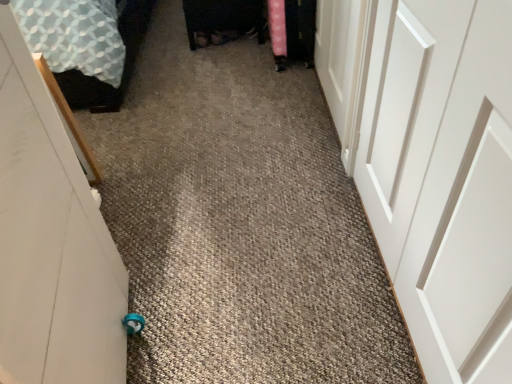
Question: Is point (396, 52) closer or farther from the camera than point (1, 258)?

Choices:
 (A) closer
 (B) farther

Answer: (B)

Question: In the image, is white smooth door at right, which is counted as the first door, starting from the right, on the left side or the right side of white matte door at left, marked as the 3th door in a right-to-left arrangement?

Choices:
 (A) right
 (B) left

Answer: (A)

Question: Based on their relative distances, which object is nearer to the white matte door at left, placed as the first door when sorted from left to right?

Choices:
 (A) patterned fabric bed at left
 (B) white matte door at upper right, positioned as the 2th door in right-to-left order
 (C) white smooth door at right, the third door viewed from the left

Answer: (C)

Question: Considering the real-world distances, which object is farthest from the white smooth door at right, which is counted as the first door, starting from the right?

Choices:
 (A) white matte door at left, placed as the first door when sorted from left to right
 (B) white matte door at upper right, arranged as the 2th door when viewed from the left
 (C) patterned fabric bed at left

Answer: (C)